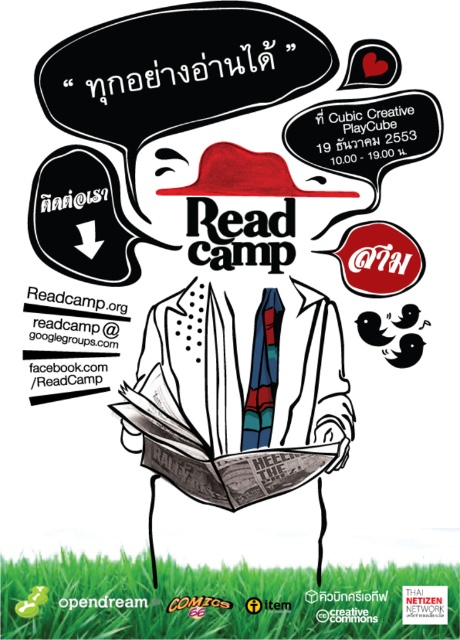
Based on the provided scene description, where is the white dotted shirt at center located in terms of its 2D coordinates?

The white dotted shirt at center is located at the 2D coordinates point (x=236, y=401).

In the scene shown: Based on the coordinates provided in the scene description, where exactly is the white dotted shirt at center located on the poster?

The white dotted shirt at center is located at point coordinates of 0.627 on the x axis and 0.515 on the y axis.